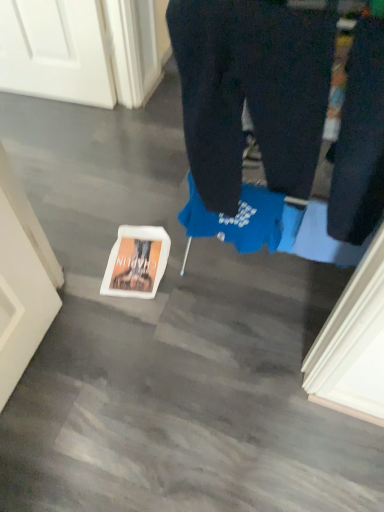
Question: In the image, is white matte book at lower center positioned in front of or behind dark blue jeans at right?

Choices:
 (A) front
 (B) behind

Answer: (B)

Question: Is white matte book at lower center wider or thinner than dark blue jeans at right?

Choices:
 (A) wide
 (B) thin

Answer: (A)

Question: Which of these objects is positioned closest to the dark blue jeans at right?

Choices:
 (A) white matte book at lower center
 (B) dark blue cotton trousers at center

Answer: (B)

Question: Which of these objects is positioned closest to the white matte book at lower center?

Choices:
 (A) dark blue cotton trousers at center
 (B) dark blue jeans at right

Answer: (A)